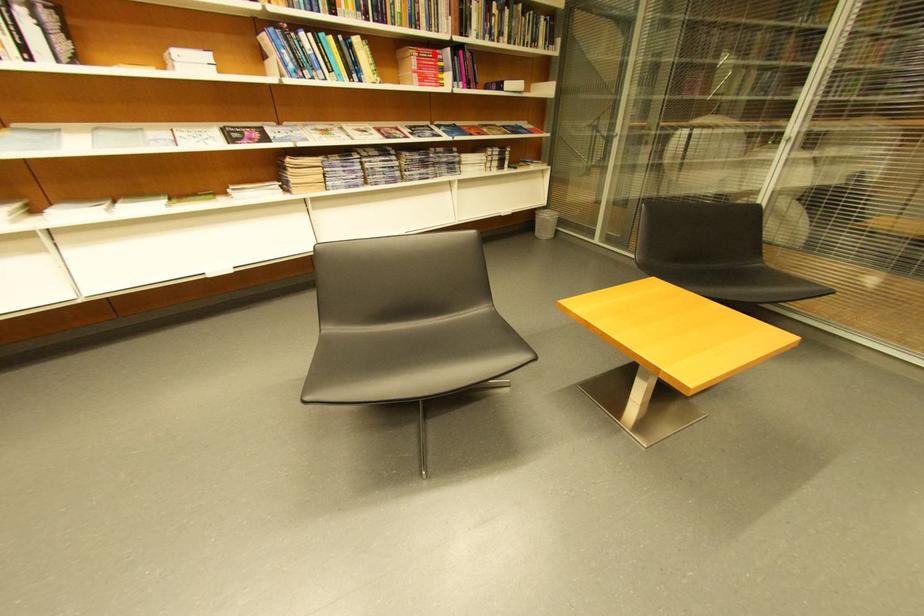
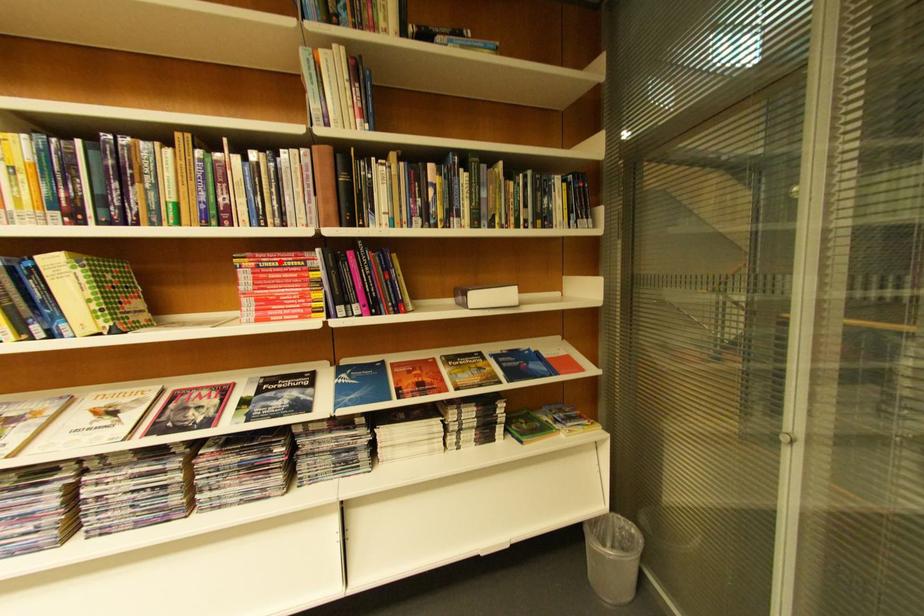
I am providing you with two images of the same scene from different viewpoints. A red point is marked on the first image and another point is marked on the second image. Does the point marked in image1 correspond to the same location as the one in image2?

Yes